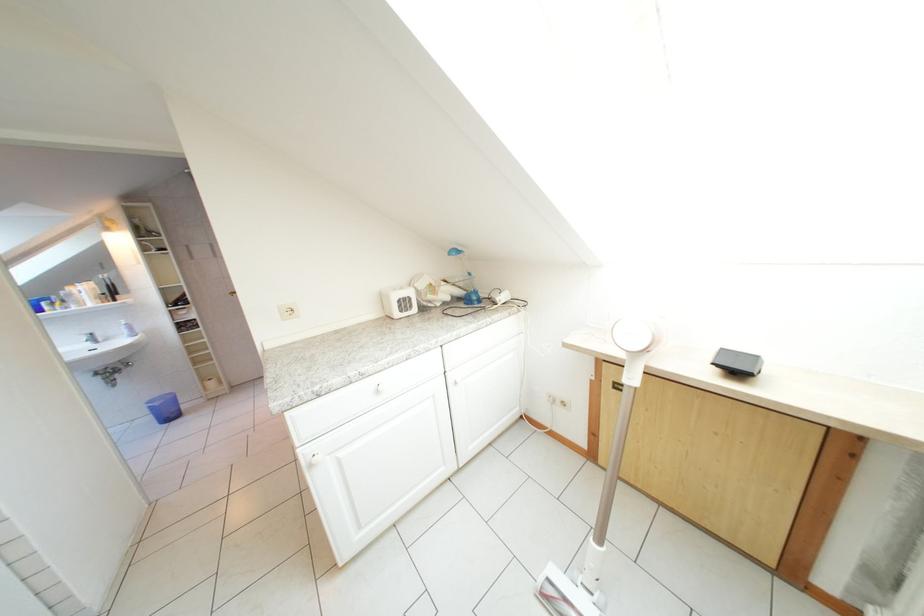
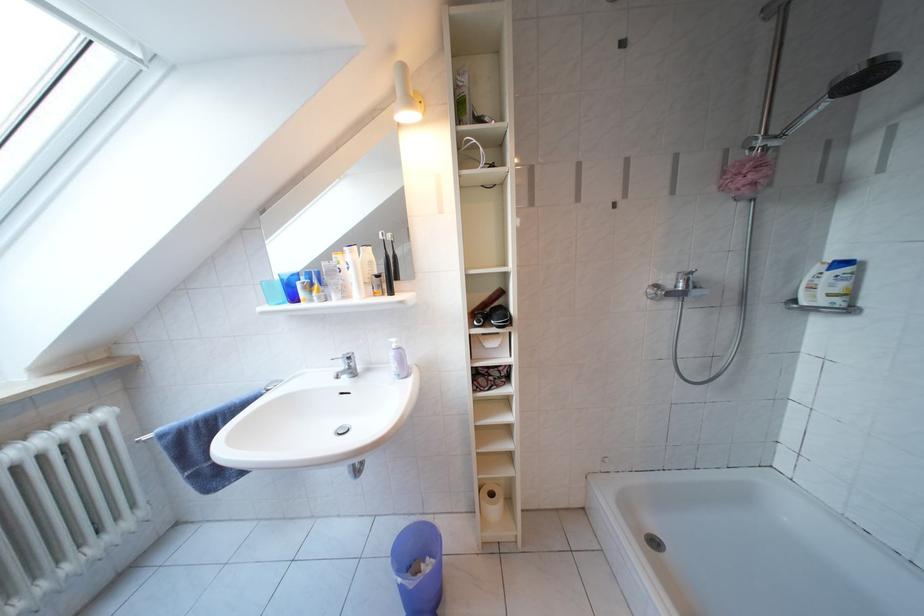
In the second image, find the point that corresponds to (94,342) in the first image.

(349, 371)